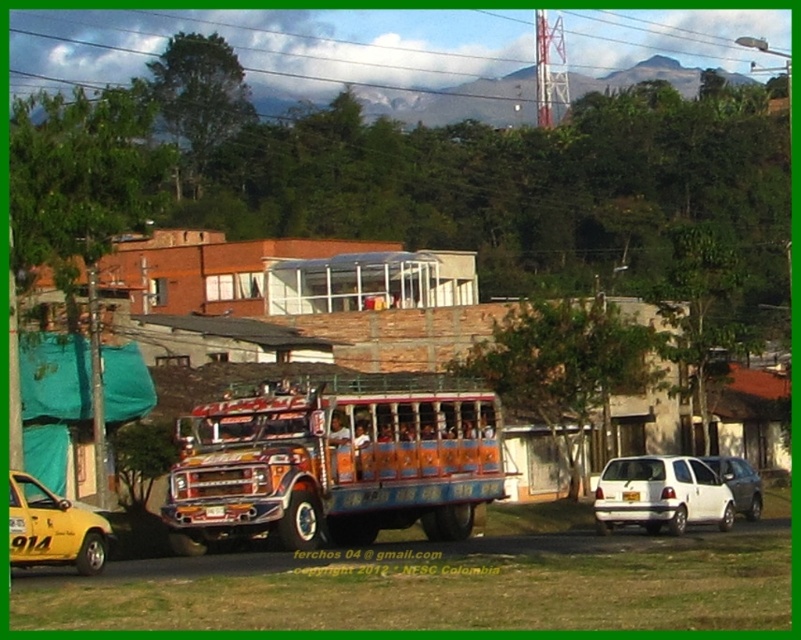
Question: Which of these objects is positioned closest to the white matte van at center?

Choices:
 (A) white matte hatchback at lower right
 (B) yellow matte taxi at lower left
 (C) painted wood bus at center

Answer: (A)

Question: Which is nearer to the white matte hatchback at lower right?

Choices:
 (A) yellow matte taxi at lower left
 (B) painted wood bus at center
 (C) white matte van at center

Answer: (C)

Question: Is the position of painted wood bus at center more distant than that of yellow matte taxi at lower left?

Choices:
 (A) yes
 (B) no

Answer: (A)

Question: Which point is closer to the camera?

Choices:
 (A) (709, 516)
 (B) (751, 490)
 (C) (55, 525)

Answer: (C)

Question: Is yellow matte taxi at lower left positioned in front of white matte van at center?

Choices:
 (A) yes
 (B) no

Answer: (A)

Question: Is painted wood bus at center bigger than white matte hatchback at lower right?

Choices:
 (A) yes
 (B) no

Answer: (B)